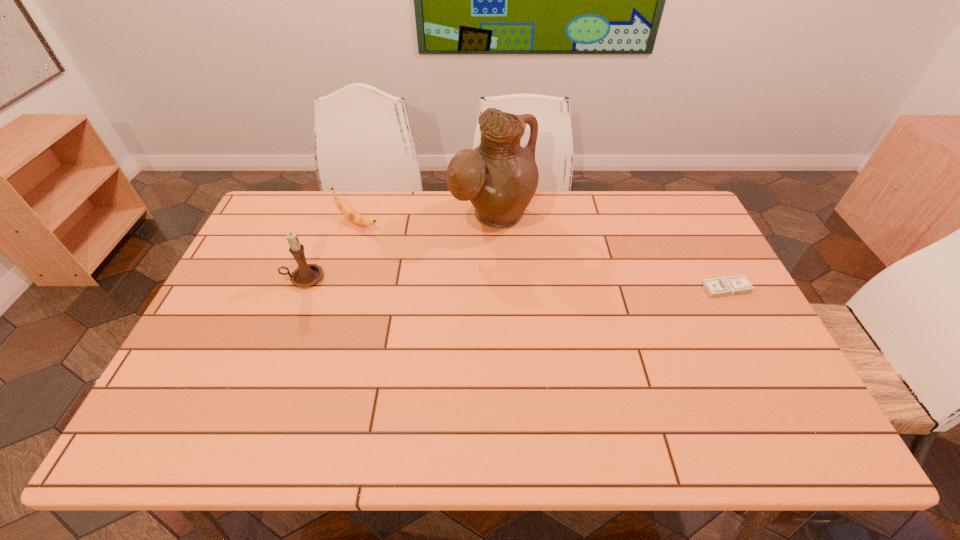
Find the location of a particular element. The height and width of the screenshot is (540, 960). vacant region at the far edge is located at coordinates (333, 234).

You are a GUI agent. You are given a task and a screenshot of the screen. Output one action in this format:
    pyautogui.click(x=<x>, y=<y>)
    Task: Click on the blank area at the near edge
    The width and height of the screenshot is (960, 540).
    Given the screenshot: What is the action you would take?
    pyautogui.click(x=388, y=405)

The image size is (960, 540). What are the coordinates of `vacant space at the left edge of the desktop` in the screenshot? It's located at (244, 344).

I want to click on free space at the right edge of the desktop, so click(665, 241).

You are a GUI agent. You are given a task and a screenshot of the screen. Output one action in this format:
    pyautogui.click(x=<x>, y=<y>)
    Task: Click on the vacant area at the far left corner of the desktop
    The height and width of the screenshot is (540, 960).
    Given the screenshot: What is the action you would take?
    pyautogui.click(x=307, y=204)

Image resolution: width=960 pixels, height=540 pixels. Identify the location of free spot at the far right corner of the desktop. (669, 200).

Locate an element on the screen. This screenshot has width=960, height=540. free space at the near right corner of the desktop is located at coordinates (780, 381).

I want to click on free spot between the candle holder and the tallest object, so click(x=398, y=248).

Identify the location of empty space that is in between the banana and the pitcher. The image size is (960, 540). (425, 220).

At what (x,y) coordinates should I click in order to perform the action: click on vacant space that's between the candle holder and the rightmost object. Please return your answer as a coordinate pair (x, y). Image resolution: width=960 pixels, height=540 pixels. Looking at the image, I should click on (516, 283).